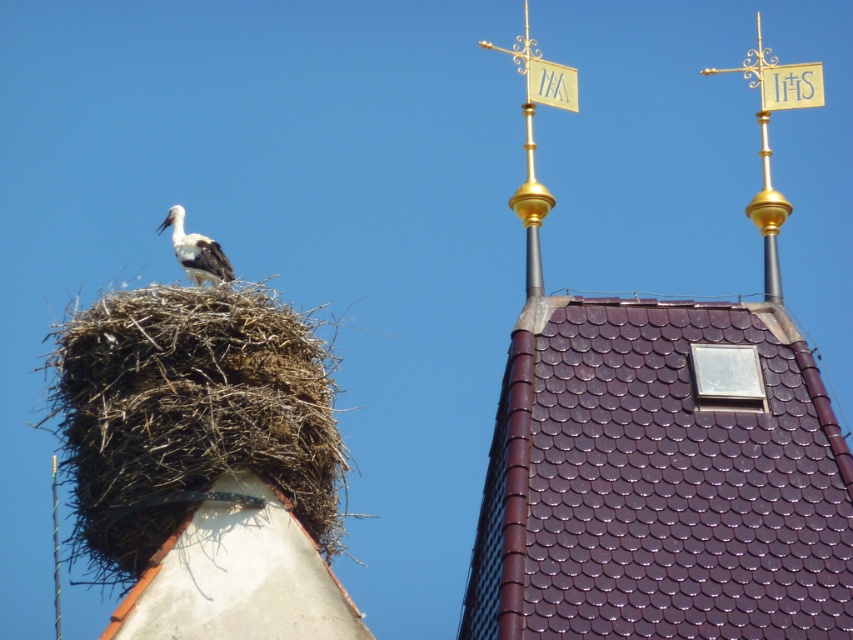
Is purple tile roof at upper center to the right of brown straw nest at upper left from the viewer's perspective?

Indeed, purple tile roof at upper center is positioned on the right side of brown straw nest at upper left.

Does purple tile roof at upper center have a larger size compared to brown straw nest at upper left?

No.

Which is behind, point (712, 598) or point (70, 381)?

Point (70, 381)

I want to click on purple tile roof at upper center, so click(x=660, y=476).

The height and width of the screenshot is (640, 853). What do you see at coordinates (236, 577) in the screenshot?
I see `brown textured nest at upper left` at bounding box center [236, 577].

Which is more to the left, brown textured nest at upper left or white matte stork at upper left?

From the viewer's perspective, white matte stork at upper left appears more on the left side.

Who is more forward, (171,611) or (196,282)?

Point (171,611) is more forward.

This screenshot has width=853, height=640. Identify the location of brown textured nest at upper left. (236, 577).

Is brown straw nest at upper left smaller than white matte stork at upper left?

No.

Who is positioned more to the right, brown straw nest at upper left or white matte stork at upper left?

white matte stork at upper left

The height and width of the screenshot is (640, 853). Identify the location of brown straw nest at upper left. (190, 416).